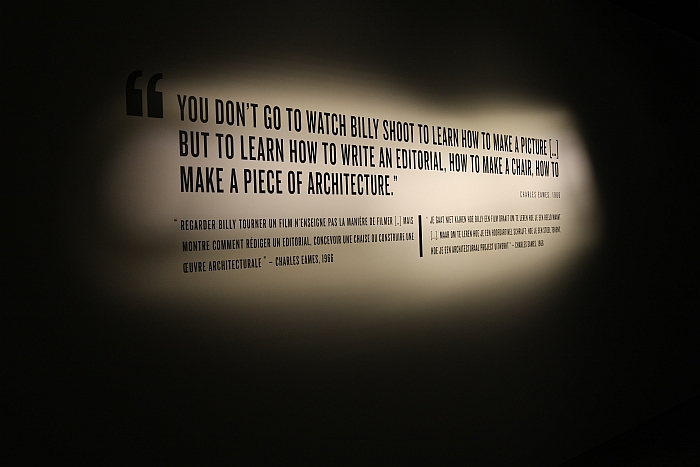
The image size is (700, 467). I want to click on spotlight, so click(x=402, y=288).